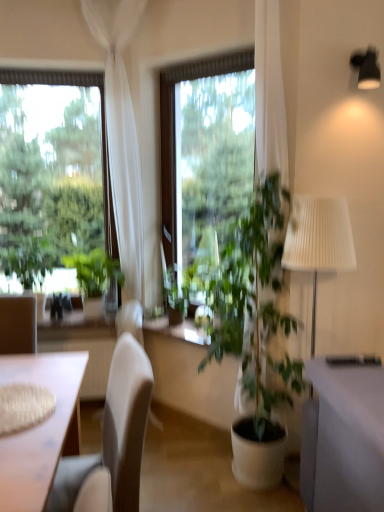
Where is `green leafy plant at center, which is counted as the first houseplant, starting from the right`? This screenshot has width=384, height=512. green leafy plant at center, which is counted as the first houseplant, starting from the right is located at coordinates (177, 295).

This screenshot has width=384, height=512. Describe the element at coordinates (124, 148) in the screenshot. I see `white sheer curtain at left` at that location.

Find the location of `transparent glass window at center, the 1th window in the right-to-left sequence`. transparent glass window at center, the 1th window in the right-to-left sequence is located at coordinates (174, 126).

What do you see at coordinates (111, 441) in the screenshot? I see `white fabric chair at left` at bounding box center [111, 441].

Image resolution: width=384 pixels, height=512 pixels. Find the location of `green leafy plant at left`. green leafy plant at left is located at coordinates (29, 260).

The height and width of the screenshot is (512, 384). I want to click on green leafy plant at center, which is counted as the first houseplant, starting from the right, so click(x=177, y=295).

Where is `houseplant on the left of white sheer curtain at left`? Image resolution: width=384 pixels, height=512 pixels. houseplant on the left of white sheer curtain at left is located at coordinates (95, 271).

From the image's perspective, does green leafy plant at left, placed as the second houseplant when sorted from right to left, appear lower than white sheer curtain at left?

Correct, green leafy plant at left, placed as the second houseplant when sorted from right to left, appears lower than white sheer curtain at left in the image.

Is green leafy plant at left, marked as the first houseplant in a left-to-right arrangement, touching white sheer curtain at left?

green leafy plant at left, marked as the first houseplant in a left-to-right arrangement, is not next to white sheer curtain at left, and they're not touching.

Consider the image. Measure the distance between green leafy plant at left, placed as the second houseplant when sorted from right to left, and white sheer curtain at left.

green leafy plant at left, placed as the second houseplant when sorted from right to left, and white sheer curtain at left are 18.17 inches apart.

Would you consider white fabric chair at left to be distant from green leafy plant at center, which is counted as the first houseplant, starting from the right?

No.

Considering the relative sizes of white fabric chair at left and green leafy plant at center, the second houseplant positioned from the left, in the image provided, is white fabric chair at left smaller than green leafy plant at center, the second houseplant positioned from the left,?

No.

Consider the image. Can you confirm if white fabric chair at left is wider than green leafy plant at center, which is counted as the first houseplant, starting from the right?

Correct, the width of white fabric chair at left exceeds that of green leafy plant at center, which is counted as the first houseplant, starting from the right.

From a real-world perspective, which object rests below the other?

white fabric chair at left.

Between green leafy plant at left and transparent glass window at center, the 2th window from the left, which one is positioned behind?

Positioned behind is green leafy plant at left.

Is green leafy plant at left in contact with transparent glass window at center, the 2th window from the left?

There is a gap between green leafy plant at left and transparent glass window at center, the 2th window from the left.

Is green leafy plant at left inside or outside of transparent glass window at center, the 2th window from the left?

green leafy plant at left is not inside transparent glass window at center, the 2th window from the left, it's outside.

From the image's perspective, who appears lower, green leafy plant at left or transparent glass window at center, the 2th window from the left?

green leafy plant at left, from the image's perspective.

Does point (9, 249) come behind point (117, 252)?

No.

Which is more to the left, green leafy plant at left or transparent glass window at left, the 1th window when ordered from left to right?

Positioned to the left is green leafy plant at left.

Could you tell me if green leafy plant at left is turned towards transparent glass window at left, the 1th window when ordered from left to right?

No, green leafy plant at left is not oriented towards transparent glass window at left, the 1th window when ordered from left to right.

Consider the image. Is green leafy plant at left smaller than transparent glass window at left, the 1th window when ordered from left to right?

Correct, green leafy plant at left occupies less space than transparent glass window at left, the 1th window when ordered from left to right.

In the scene shown: Does transparent glass window at center, the 1th window in the right-to-left sequence, have a lesser height compared to green leafy plant at center, the second houseplant positioned from the left?

Incorrect, the height of transparent glass window at center, the 1th window in the right-to-left sequence, does not fall short of that of green leafy plant at center, the second houseplant positioned from the left.

In the scene shown: Is transparent glass window at center, the 2th window from the left, oriented towards green leafy plant at center, which is counted as the first houseplant, starting from the right?

Yes, transparent glass window at center, the 2th window from the left, is aimed at green leafy plant at center, which is counted as the first houseplant, starting from the right.

Does transparent glass window at center, the 1th window in the right-to-left sequence, have a greater width compared to green leafy plant at center, which is counted as the first houseplant, starting from the right?

Incorrect, the width of transparent glass window at center, the 1th window in the right-to-left sequence, does not surpass that of green leafy plant at center, which is counted as the first houseplant, starting from the right.

Where is `the 1st houseplant counting from the left side of the transparent glass window at center, the 2th window from the left`? the 1st houseplant counting from the left side of the transparent glass window at center, the 2th window from the left is located at coordinates (177, 295).

Does white fabric chair at left have a lesser height compared to green leafy plant at left, marked as the first houseplant in a left-to-right arrangement?

Incorrect, the height of white fabric chair at left does not fall short of that of green leafy plant at left, marked as the first houseplant in a left-to-right arrangement.

From the picture: Which of these two, white fabric chair at left or green leafy plant at left, placed as the second houseplant when sorted from right to left, is smaller?

With smaller size is green leafy plant at left, placed as the second houseplant when sorted from right to left.

Are white fabric chair at left and green leafy plant at left, placed as the second houseplant when sorted from right to left, far apart?

white fabric chair at left is positioned a significant distance from green leafy plant at left, placed as the second houseplant when sorted from right to left.

How far apart are white fabric chair at left and green leafy plant at left, placed as the second houseplant when sorted from right to left?

white fabric chair at left and green leafy plant at left, placed as the second houseplant when sorted from right to left, are 1.20 meters apart.

Based on the photo, from a real-world perspective, does green leafy plant at center, which is counted as the first houseplant, starting from the right, sit lower than transparent glass window at center, the 1th window in the right-to-left sequence?

Yes.

From the image's perspective, count 1st windows upward from the green leafy plant at center, which is counted as the first houseplant, starting from the right, and point to it. Please provide its 2D coordinates.

[(174, 126)]

Can you confirm if green leafy plant at center, which is counted as the first houseplant, starting from the right, is smaller than transparent glass window at center, the 1th window in the right-to-left sequence?

Yes, green leafy plant at center, which is counted as the first houseplant, starting from the right, is smaller than transparent glass window at center, the 1th window in the right-to-left sequence.

Is transparent glass window at center, the 2th window from the left, completely or partially inside green leafy plant at center, the second houseplant positioned from the left?

That's incorrect, transparent glass window at center, the 2th window from the left, is not inside green leafy plant at center, the second houseplant positioned from the left.

There is a white sheer curtain at left. Where is `the 1st houseplant below it (from the image's perspective)`? This screenshot has width=384, height=512. the 1st houseplant below it (from the image's perspective) is located at coordinates (95, 271).

This screenshot has height=512, width=384. Identify the location of chair on the left side of green leafy plant at center, which is counted as the first houseplant, starting from the right. (111, 441).

Based on their spatial positions, is transparent glass window at left, the 1th window when ordered from left to right, or white fabric chair at left closer to white sheer curtain at left?

transparent glass window at left, the 1th window when ordered from left to right, is closer to white sheer curtain at left.

In the scene shown: When comparing their distances from green leafy plant at left, placed as the second houseplant when sorted from right to left, does white sheer curtain at left or transparent glass window at center, the 2th window from the left, seem closer?

Among the two, white sheer curtain at left is located nearer to green leafy plant at left, placed as the second houseplant when sorted from right to left.

Estimate the real-world distances between objects in this image. Which object is closer to white sheer curtain at left, green leafy plant at left, marked as the first houseplant in a left-to-right arrangement, or transparent glass window at left, the 1th window when ordered from left to right?

transparent glass window at left, the 1th window when ordered from left to right, lies closer to white sheer curtain at left than the other object.

Considering their positions, is green leafy plant at center, the second houseplant positioned from the left, positioned closer to transparent glass window at center, the 1th window in the right-to-left sequence, than green leafy plant at left, placed as the second houseplant when sorted from right to left?

The object closer to transparent glass window at center, the 1th window in the right-to-left sequence, is green leafy plant at center, the second houseplant positioned from the left.

Which object lies nearer to the anchor point green leafy plant at left, white sheer curtain at left or green leafy plant at left, placed as the second houseplant when sorted from right to left?

green leafy plant at left, placed as the second houseplant when sorted from right to left, is positioned closer to the anchor green leafy plant at left.

Looking at the image, which one is located further to transparent glass window at left, marked as the 2th window in a right-to-left arrangement, transparent glass window at center, the 1th window in the right-to-left sequence, or green leafy plant at left?

green leafy plant at left lies further to transparent glass window at left, marked as the 2th window in a right-to-left arrangement, than the other object.

Looking at the image, which one is located further to transparent glass window at center, the 2th window from the left, green leafy plant at left, marked as the first houseplant in a left-to-right arrangement, or green leafy plant at center, the second houseplant positioned from the left?

green leafy plant at left, marked as the first houseplant in a left-to-right arrangement, is positioned further to the anchor transparent glass window at center, the 2th window from the left.

Which object lies nearer to the anchor point white sheer curtain at left, green leafy plant at left, placed as the second houseplant when sorted from right to left, or transparent glass window at center, the 1th window in the right-to-left sequence?

transparent glass window at center, the 1th window in the right-to-left sequence.

In order to click on window between green leafy plant at left and green leafy plant at center, which is counted as the first houseplant, starting from the right in this screenshot , I will do `click(101, 125)`.

Where is `curtain between transparent glass window at left, marked as the 2th window in a right-to-left arrangement, and green leafy plant at center, which is counted as the first houseplant, starting from the right`? The width and height of the screenshot is (384, 512). curtain between transparent glass window at left, marked as the 2th window in a right-to-left arrangement, and green leafy plant at center, which is counted as the first houseplant, starting from the right is located at coordinates (124, 148).

Identify the location of curtain located between white fabric chair at left and transparent glass window at left, the 1th window when ordered from left to right, in the depth direction. (124, 148).

Locate an element on the screen. curtain located between white fabric chair at left and green leafy plant at center, the second houseplant positioned from the left, in the depth direction is located at coordinates (124, 148).